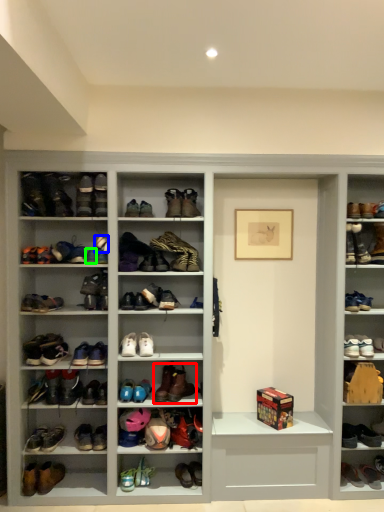
Question: Based on their relative distances, which object is farther from footwear (highlighted by a red box)? Choose from shoe (highlighted by a blue box) and shoe (highlighted by a green box).

Choices:
 (A) shoe
 (B) shoe

Answer: (A)